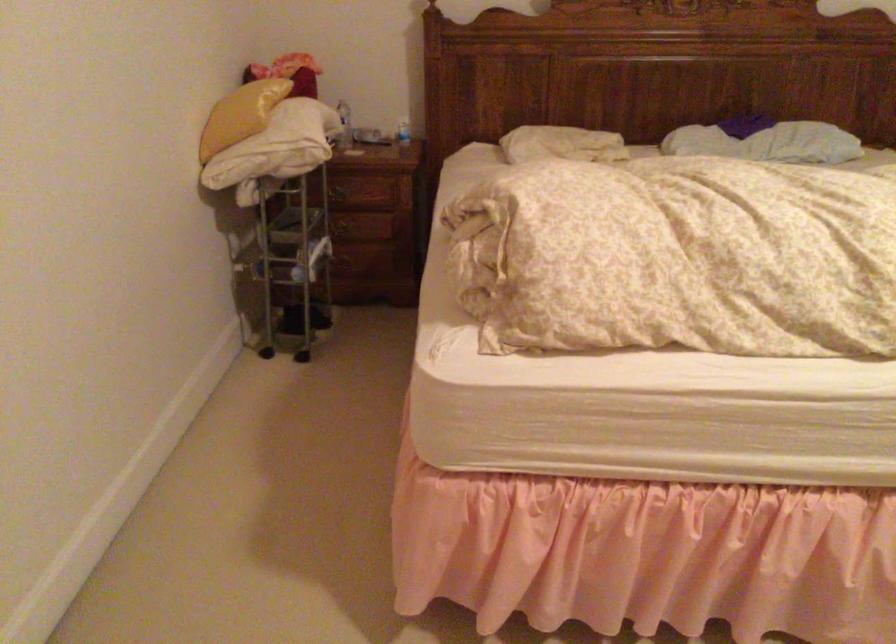
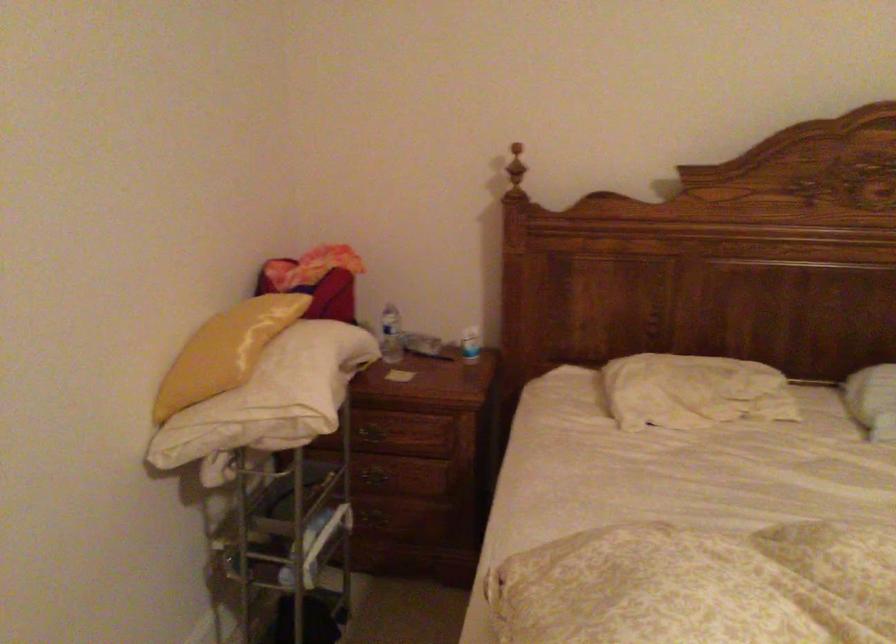
Find the pixel in the second image that matches (x=343, y=190) in the first image.

(374, 430)